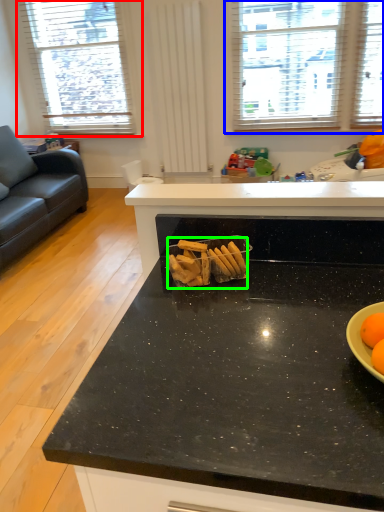
Question: Which object is the closest to the window (highlighted by a red box)? Choose among these: window (highlighted by a blue box) or snack (highlighted by a green box).

Choices:
 (A) window
 (B) snack

Answer: (A)